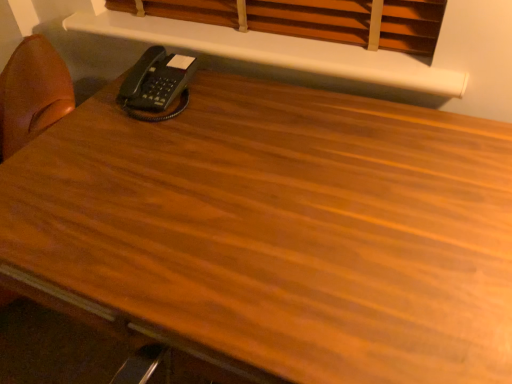
Image resolution: width=512 pixels, height=384 pixels. Describe the element at coordinates (274, 50) in the screenshot. I see `white matte shelf at upper center` at that location.

This screenshot has width=512, height=384. I want to click on wooden blinds at upper center, so 312,19.

Where is `white matte shelf at upper center`? white matte shelf at upper center is located at coordinates (274, 50).

Which is correct: wooden blinds at upper center is inside black plastic phone at upper left, or outside of it?

wooden blinds at upper center is spatially situated outside black plastic phone at upper left.

Does wooden blinds at upper center touch black plastic phone at upper left?

No, wooden blinds at upper center is not in contact with black plastic phone at upper left.

Is wooden blinds at upper center bigger than black plastic phone at upper left?

Yes, wooden blinds at upper center is bigger than black plastic phone at upper left.

Is wooden blinds at upper center positioned with its back to black plastic phone at upper left?

No, black plastic phone at upper left is not at the back of wooden blinds at upper center.

Which point is more distant from viewer, [106,34] or [325,20]?

The point [106,34] is farther from the camera.

Is white matte shelf at upper center touching wooden blinds at upper center?

Yes, white matte shelf at upper center is right next to wooden blinds at upper center and making contact.

How different are the orientations of white matte shelf at upper center and wooden blinds at upper center in degrees?

The facing directions of white matte shelf at upper center and wooden blinds at upper center are 1 degrees apart.

Who is more distant, white matte shelf at upper center or black plastic phone at upper left?

black plastic phone at upper left is more distant.

Which object is wider, white matte shelf at upper center or black plastic phone at upper left?

Wider between the two is black plastic phone at upper left.

Considering the positions of points (401, 66) and (177, 64), is point (401, 66) closer to camera compared to point (177, 64)?

That is True.

From the image's perspective, is white matte shelf at upper center below black plastic phone at upper left?

Incorrect, from the image's perspective, white matte shelf at upper center is higher than black plastic phone at upper left.

In terms of height, does black plastic phone at upper left look taller or shorter compared to wooden blinds at upper center?

In the image, black plastic phone at upper left appears to be shorter than wooden blinds at upper center.

Who is smaller, black plastic phone at upper left or wooden blinds at upper center?

With smaller size is black plastic phone at upper left.

From a real-world perspective, is black plastic phone at upper left physically below wooden blinds at upper center?

Correct, in the physical world, black plastic phone at upper left is lower than wooden blinds at upper center.

Considering the relative positions of black plastic phone at upper left and wooden blinds at upper center in the image provided, is black plastic phone at upper left to the left or to the right of wooden blinds at upper center?

black plastic phone at upper left is positioned on wooden blinds at upper center's left side.

Is wooden blinds at upper center looking in the opposite direction of white matte shelf at upper center?

No.

Which is correct: wooden blinds at upper center is inside white matte shelf at upper center, or outside of it?

wooden blinds at upper center is not inside white matte shelf at upper center, it's outside.

Between point (421, 13) and point (294, 60), which one is positioned behind?

Positioned behind is point (294, 60).

Is the depth of wooden blinds at upper center less than that of white matte shelf at upper center?

That is True.

Are black plastic phone at upper left and white matte shelf at upper center beside each other?

No.

From the image's perspective, which is below, black plastic phone at upper left or white matte shelf at upper center?

From the image's view, black plastic phone at upper left is below.

Which object is wider, black plastic phone at upper left or white matte shelf at upper center?

black plastic phone at upper left is wider.

Which point is more forward, (181, 84) or (422, 65)?

The point (422, 65) is more forward.

Where is `curtain located in front of the black plastic phone at upper left`? This screenshot has height=384, width=512. curtain located in front of the black plastic phone at upper left is located at coordinates (312, 19).

This screenshot has height=384, width=512. Identify the location of shelf behind the wooden blinds at upper center. (274, 50).

In the scene shown: Looking at the image, which one is located further to black plastic phone at upper left, white matte shelf at upper center or wooden blinds at upper center?

wooden blinds at upper center is further to black plastic phone at upper left.

Estimate the real-world distances between objects in this image. Which object is closer to white matte shelf at upper center, wooden blinds at upper center or black plastic phone at upper left?

The object closer to white matte shelf at upper center is wooden blinds at upper center.

Considering their positions, is black plastic phone at upper left positioned closer to white matte shelf at upper center than wooden blinds at upper center?

wooden blinds at upper center is closer to white matte shelf at upper center.

Considering their positions, is black plastic phone at upper left positioned closer to wooden blinds at upper center than white matte shelf at upper center?

Among the two, white matte shelf at upper center is located nearer to wooden blinds at upper center.

Looking at the image, which one is located closer to black plastic phone at upper left, wooden blinds at upper center or white matte shelf at upper center?

white matte shelf at upper center is positioned closer to the anchor black plastic phone at upper left.

Based on their spatial positions, is white matte shelf at upper center or black plastic phone at upper left further from wooden blinds at upper center?

black plastic phone at upper left.

Identify the location of shelf situated between black plastic phone at upper left and wooden blinds at upper center from left to right. This screenshot has width=512, height=384. (274, 50).